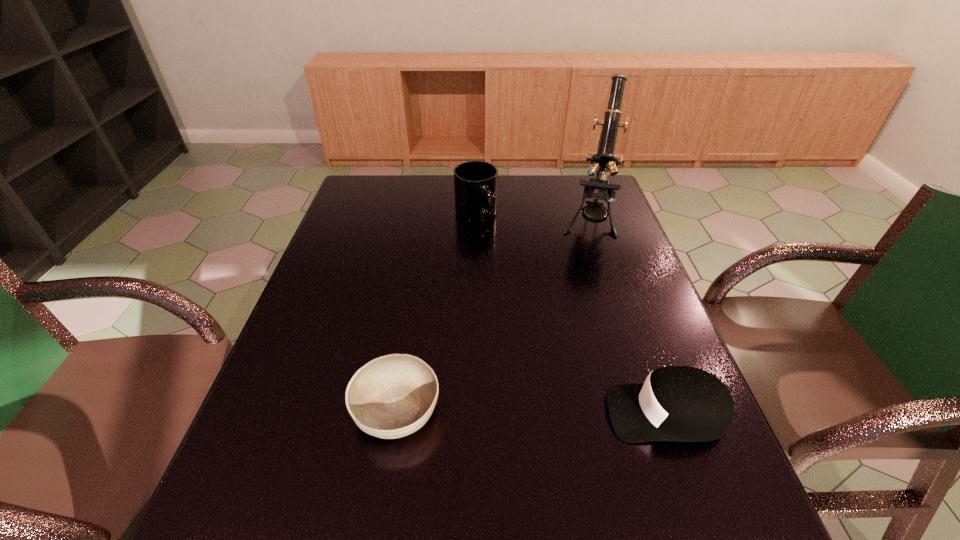
At what (x,y) coordinates should I click in order to perform the action: click on vacant spot on the desktop that is between the bowl and the cap and is positioned with the handle on the side of the mug. Please return your answer as a coordinate pair (x, y). This screenshot has width=960, height=540. Looking at the image, I should click on (534, 411).

This screenshot has height=540, width=960. What are the coordinates of `free space on the desktop that is between the shortest object and the cap and is positioned through the eyepiece of the microscope` in the screenshot? It's located at (556, 411).